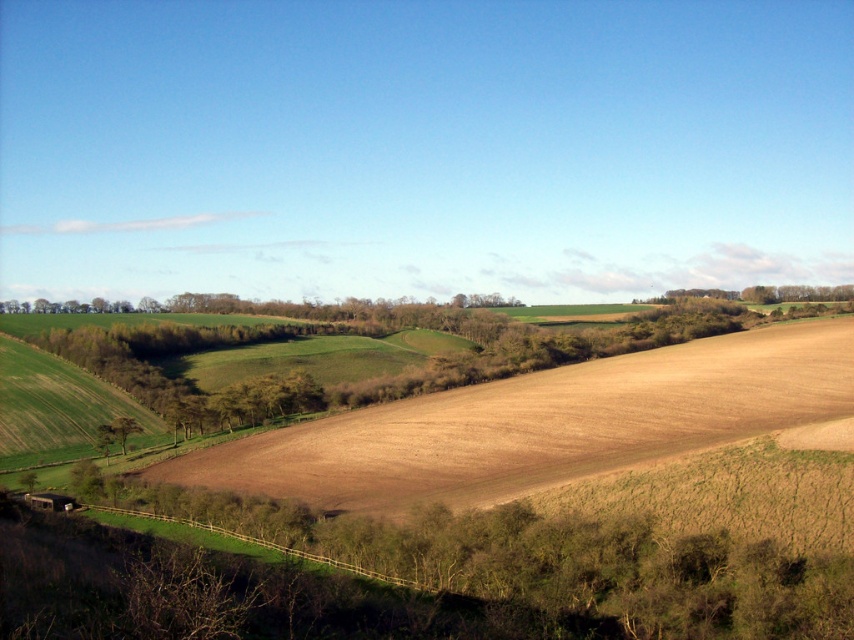
Question: Is brown soil at lower left above green leafy tree at lower left?

Choices:
 (A) no
 (B) yes

Answer: (B)

Question: Which of the following is the farthest from the observer?

Choices:
 (A) green leafy tree at lower left
 (B) brown soil at lower left

Answer: (A)

Question: Among these objects, which one is nearest to the camera?

Choices:
 (A) green leafy tree at lower left
 (B) brown soil at lower left

Answer: (B)

Question: Is brown soil at lower left above green leafy tree at lower left?

Choices:
 (A) yes
 (B) no

Answer: (A)

Question: Is brown soil at lower left further to camera compared to green leafy tree at lower left?

Choices:
 (A) no
 (B) yes

Answer: (A)

Question: Which point is closer to the camera?

Choices:
 (A) brown soil at lower left
 (B) green leafy tree at lower left

Answer: (A)